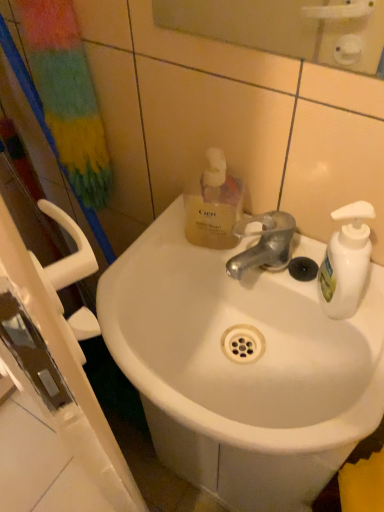
Describe the element at coordinates (213, 204) in the screenshot. Image resolution: width=384 pixels, height=512 pixels. I see `translucent yellow liquid at upper center` at that location.

What is the approximate width of white ceramic sink at center?

white ceramic sink at center is 13.66 inches in width.

Locate an element on the screen. The height and width of the screenshot is (512, 384). translucent yellow liquid at upper center is located at coordinates (213, 204).

Which is further, (295, 14) or (377, 332)?

The point (295, 14) is behind.

Which of these two, glossy plastic mirror at upper center or white ceramic sink at center, stands shorter?

white ceramic sink at center is shorter.

Considering the positions of objects glossy plastic mirror at upper center and white ceramic sink at center in the image provided, who is more to the right, glossy plastic mirror at upper center or white ceramic sink at center?

Positioned to the right is glossy plastic mirror at upper center.

From a real-world perspective, relative to translucent yellow liquid at upper center, is glossy plastic mirror at upper center vertically above or below?

From a real-world perspective, glossy plastic mirror at upper center is physically above translucent yellow liquid at upper center.

Choose the correct answer: Is glossy plastic mirror at upper center inside translucent yellow liquid at upper center or outside it?

glossy plastic mirror at upper center is not enclosed by translucent yellow liquid at upper center.

Which point is more distant from viewer, (203, 35) or (230, 178)?

The point (203, 35) is farther.

Who is bigger, translucent yellow liquid at upper center or glossy plastic mirror at upper center?

glossy plastic mirror at upper center is bigger.

From the picture: From the image's perspective, is translucent yellow liquid at upper center located above glossy plastic mirror at upper center?

Actually, translucent yellow liquid at upper center appears below glossy plastic mirror at upper center in the image.

Considering the sizes of objects translucent yellow liquid at upper center and glossy plastic mirror at upper center in the image provided, who is shorter, translucent yellow liquid at upper center or glossy plastic mirror at upper center?

translucent yellow liquid at upper center.

Image resolution: width=384 pixels, height=512 pixels. Identify the location of bottle on the left of glossy plastic mirror at upper center. (213, 204).

Is white ceramic sink at center facing away from translucent yellow liquid at upper center?

That's not correct — white ceramic sink at center is not looking away from translucent yellow liquid at upper center.

From a real-world perspective, who is located lower, white ceramic sink at center or translucent yellow liquid at upper center?

From a 3D spatial view, white ceramic sink at center is below.

Would you say white ceramic sink at center is to the left or to the right of translucent yellow liquid at upper center in the picture?

Clearly, white ceramic sink at center is on the right of translucent yellow liquid at upper center in the image.

Is white ceramic sink at center inside or outside of translucent yellow liquid at upper center?

white ceramic sink at center exists outside the volume of translucent yellow liquid at upper center.

Is white ceramic sink at center not near glossy plastic mirror at upper center?

Actually, white ceramic sink at center and glossy plastic mirror at upper center are a little close together.

From the picture: Which object is wider, white ceramic sink at center or glossy plastic mirror at upper center?

white ceramic sink at center is wider.

Can you confirm if white ceramic sink at center is bigger than glossy plastic mirror at upper center?

Yes, white ceramic sink at center is bigger than glossy plastic mirror at upper center.

At what (x,y) coordinates should I click in order to perform the action: click on mirror in front of the white ceramic sink at center. Please return your answer as a coordinate pair (x, y). The image size is (384, 512). Looking at the image, I should click on (287, 28).

Considering the sizes of translucent yellow liquid at upper center and white ceramic sink at center in the image, is translucent yellow liquid at upper center taller or shorter than white ceramic sink at center?

Clearly, translucent yellow liquid at upper center is taller compared to white ceramic sink at center.

Considering the relative sizes of translucent yellow liquid at upper center and white ceramic sink at center in the image provided, is translucent yellow liquid at upper center bigger than white ceramic sink at center?

No.

Is translucent yellow liquid at upper center wider than white ceramic sink at center?

Incorrect, the width of translucent yellow liquid at upper center does not surpass that of white ceramic sink at center.

Locate an element on the screen. sink below the glossy plastic mirror at upper center (from a real-world perspective) is located at coordinates (242, 368).

Image resolution: width=384 pixels, height=512 pixels. In order to click on mirror above the translucent yellow liquid at upper center (from a real-world perspective) in this screenshot , I will do `click(287, 28)`.

Considering their positions, is white ceramic sink at center positioned closer to glossy plastic mirror at upper center than translucent yellow liquid at upper center?

translucent yellow liquid at upper center is positioned closer to the anchor glossy plastic mirror at upper center.

Estimate the real-world distances between objects in this image. Which object is closer to translucent yellow liquid at upper center, white ceramic sink at center or glossy plastic mirror at upper center?

The object closer to translucent yellow liquid at upper center is white ceramic sink at center.

From the image, which object appears to be farther from glossy plastic mirror at upper center, translucent yellow liquid at upper center or white ceramic sink at center?

Based on the image, white ceramic sink at center appears to be further to glossy plastic mirror at upper center.

Which object lies nearer to the anchor point translucent yellow liquid at upper center, glossy plastic mirror at upper center or white ceramic sink at center?

Among the two, white ceramic sink at center is located nearer to translucent yellow liquid at upper center.

Which object lies further to the anchor point white ceramic sink at center, glossy plastic mirror at upper center or translucent yellow liquid at upper center?

glossy plastic mirror at upper center.

Based on their spatial positions, is translucent yellow liquid at upper center or glossy plastic mirror at upper center closer to white ceramic sink at center?

translucent yellow liquid at upper center lies closer to white ceramic sink at center than the other object.

At what (x,y) coordinates should I click in order to perform the action: click on bottle between glossy plastic mirror at upper center and white ceramic sink at center in the vertical direction. Please return your answer as a coordinate pair (x, y). The width and height of the screenshot is (384, 512). Looking at the image, I should click on pyautogui.click(x=213, y=204).